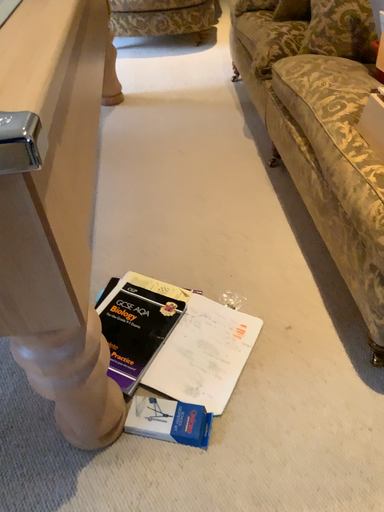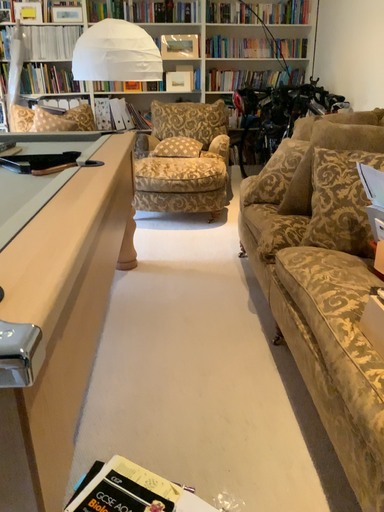
Question: Which way did the camera rotate in the video?

Choices:
 (A) rotated upward
 (B) rotated downward

Answer: (A)